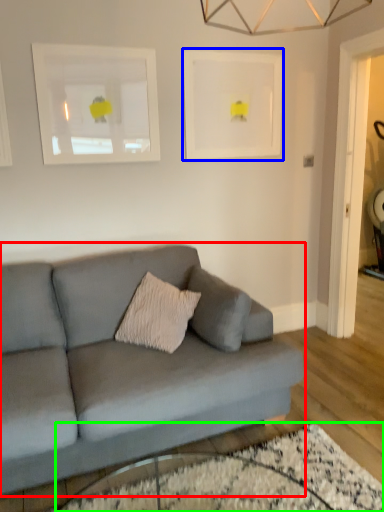
Question: Estimate the real-world distances between objects in this image. Which object is farther from studio couch (highlighted by a red box), picture frame (highlighted by a blue box) or glass table (highlighted by a green box)?

Choices:
 (A) picture frame
 (B) glass table

Answer: (A)